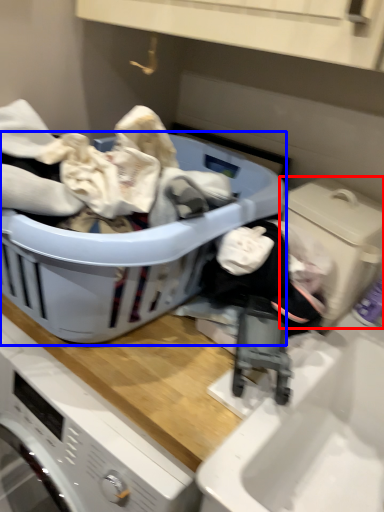
Question: Which object appears closest to the camera in this image, washing machine (highlighted by a red box) or laundry basket (highlighted by a blue box)?

Choices:
 (A) washing machine
 (B) laundry basket

Answer: (B)